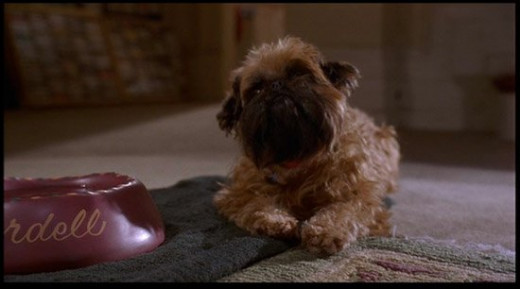
Locate an element on the screen. rug is located at coordinates (309, 268), (214, 243).